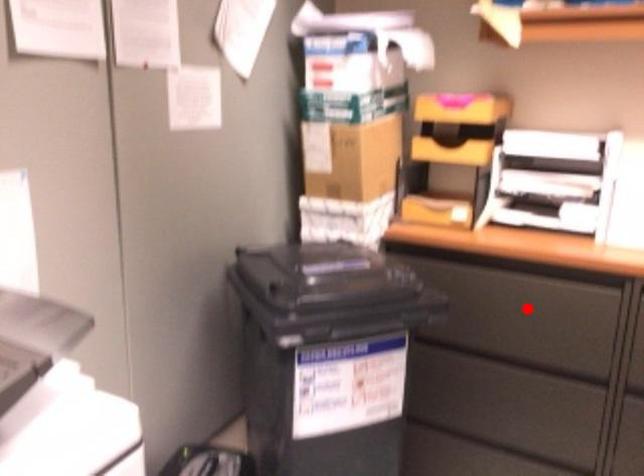
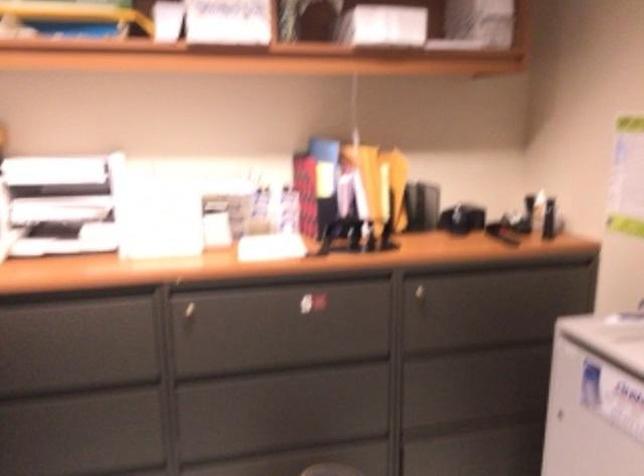
The point at the highlighted location is marked in the first image. Where is the corresponding point in the second image?

(70, 336)